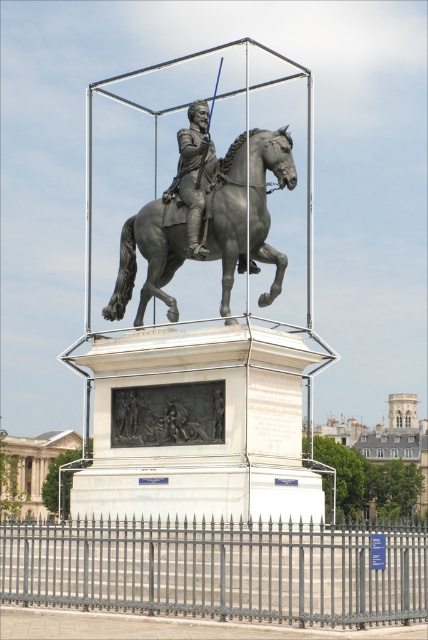
Question: Which of the following is the farthest from the observer?

Choices:
 (A) dark gray bas-relief at center
 (B) polished bronze rider at center
 (C) polished bronze horse at center

Answer: (B)

Question: Does transparent glass box at center appear on the right side of polished bronze rider at center?

Choices:
 (A) no
 (B) yes

Answer: (B)

Question: Does polished bronze horse at center have a smaller size compared to dark gray bas-relief at center?

Choices:
 (A) no
 (B) yes

Answer: (A)

Question: Does dark gray bas-relief at center have a larger size compared to polished bronze rider at center?

Choices:
 (A) no
 (B) yes

Answer: (A)

Question: Which of the following is the farthest from the observer?

Choices:
 (A) (225, 294)
 (B) (198, 129)

Answer: (B)

Question: Which object appears closest to the camera in this image?

Choices:
 (A) polished bronze rider at center
 (B) dark gray bas-relief at center
 (C) polished bronze horse at center

Answer: (B)